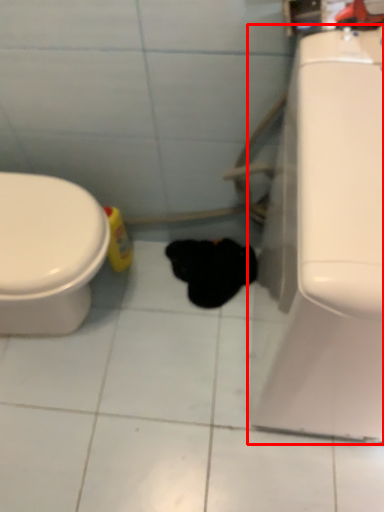
Question: From the image's perspective, where is porcelain (annotated by the red box) located in relation to animal in the image?

Choices:
 (A) above
 (B) below

Answer: (A)